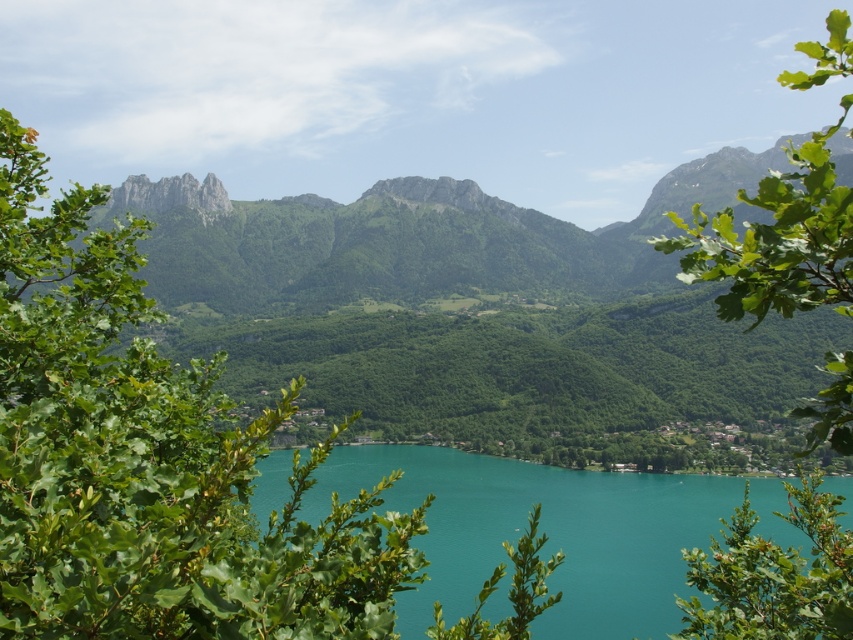
Question: Among these points, which one is farthest from the camera?

Choices:
 (A) (820, 422)
 (B) (541, 634)
 (C) (25, 465)
 (D) (837, 540)

Answer: (B)

Question: Can you confirm if teal glossy water at center is positioned to the right of green leafy tree at upper right?

Choices:
 (A) yes
 (B) no

Answer: (B)

Question: Considering the relative positions of green leafy tree at left and teal glossy water at center in the image provided, where is green leafy tree at left located with respect to teal glossy water at center?

Choices:
 (A) above
 (B) below

Answer: (A)

Question: Which point is farther to the camera?

Choices:
 (A) green leafy tree at lower right
 (B) green leafy tree at left

Answer: (A)

Question: Considering the relative positions of green leafy tree at left and green leafy tree at upper right in the image provided, where is green leafy tree at left located with respect to green leafy tree at upper right?

Choices:
 (A) above
 (B) below

Answer: (B)

Question: Which point is closer to the camera?

Choices:
 (A) (819, 134)
 (B) (90, 476)

Answer: (B)